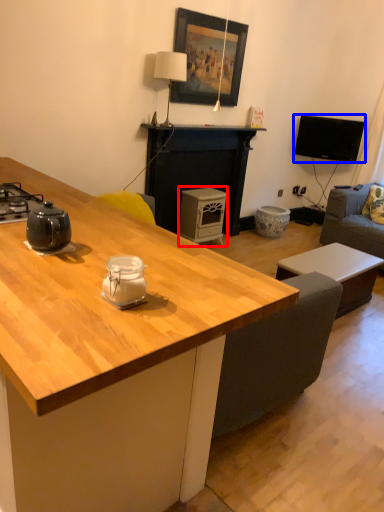
Question: Which object appears farthest to the camera in this image, appliance (highlighted by a red box) or television (highlighted by a blue box)?

Choices:
 (A) appliance
 (B) television

Answer: (B)